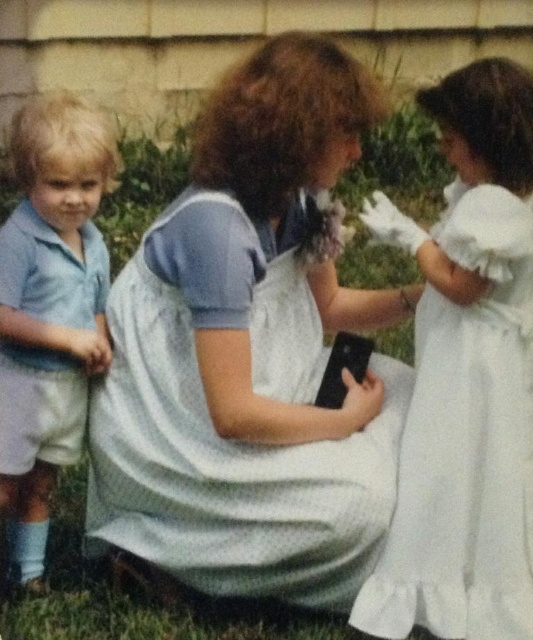
What is located at the coordinate point (251, 355) in the image?

The white cotton dress at center is located at the coordinate point (251, 355).

You are a photographer trying to capture a group photo of the white satin dress at right and the matte blue shirt at left. Which clothing item should you focus on first if you want to ensure both are in frame and properly sized?

The white satin dress at right is bigger than the matte blue shirt at left, so you should focus on the white satin dress at right first to ensure it fits well within the frame before adjusting for the smaller matte blue shirt at left.

You are organizing a playdate and need to arrange two children wearing the white satin dress at right and the matte blue shirt at left side by side. Which child will need more space horizontally?

Answer: The white satin dress at right is wider than the matte blue shirt at left, so the child wearing the white satin dress at right will require more horizontal space.